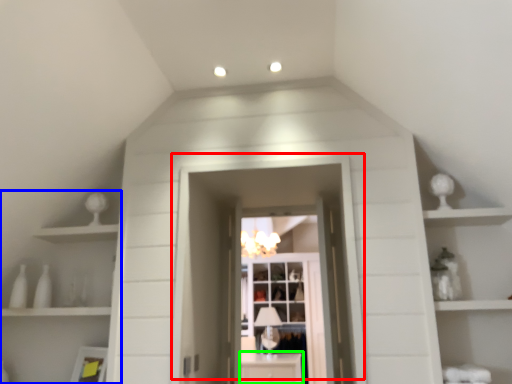
Question: Estimate the real-world distances between objects in this image. Which object is farther from door (highlighted by a red box), shelf (highlighted by a blue box) or cabinetry (highlighted by a green box)?

Choices:
 (A) shelf
 (B) cabinetry

Answer: (B)